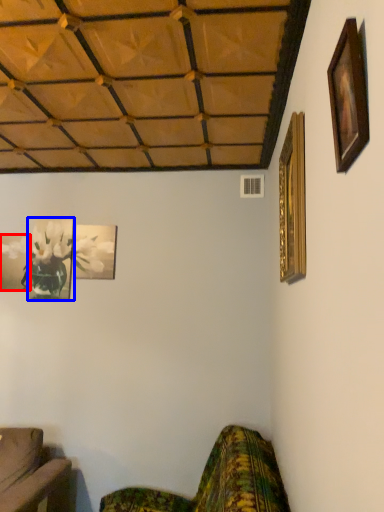
Question: Among these objects, which one is farthest to the camera, picture frame (highlighted by a red box) or picture frame (highlighted by a blue box)?

Choices:
 (A) picture frame
 (B) picture frame

Answer: (A)